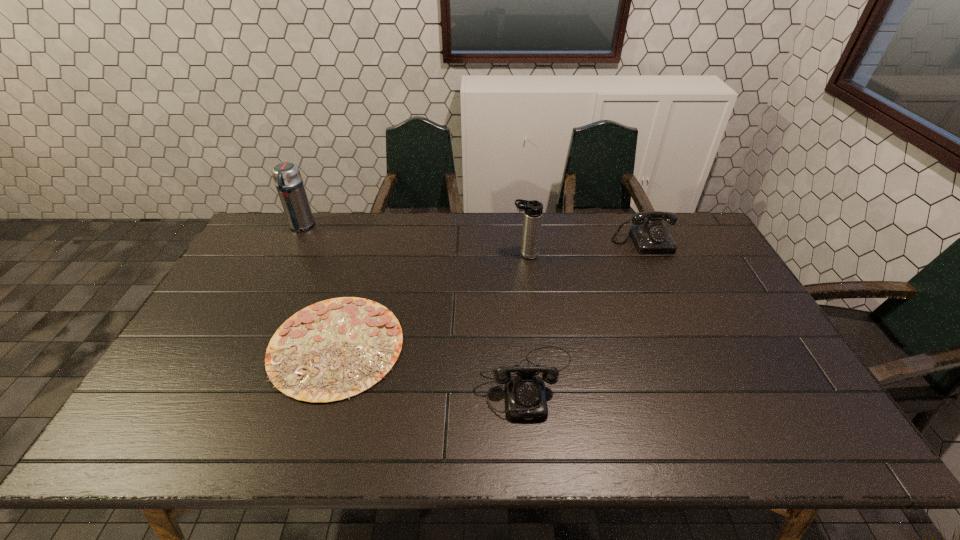
This screenshot has height=540, width=960. I want to click on vacant space at the far edge of the desktop, so click(338, 212).

Locate an element on the screen. free location at the near edge of the desktop is located at coordinates (672, 419).

In the image, there is a desktop. Find the location of `free space at the left edge`. free space at the left edge is located at coordinates (247, 275).

Locate an element on the screen. The image size is (960, 540). vacant space at the right edge is located at coordinates (783, 372).

You are a GUI agent. You are given a task and a screenshot of the screen. Output one action in this format:
    pyautogui.click(x=<x>, y=<y>)
    Task: Click on the vacant space in between the leftmost object and the rightmost object
    
    Given the screenshot: What is the action you would take?
    pyautogui.click(x=472, y=234)

The width and height of the screenshot is (960, 540). What are the coordinates of `unoccupied position between the left telephone and the fourth object from right to left` in the screenshot? It's located at (432, 363).

Find the location of a particular element. Image resolution: width=960 pixels, height=540 pixels. empty space that is in between the pizza and the leftmost object is located at coordinates (319, 286).

Where is `free space between the right thermos bottle and the rightmost object`? The height and width of the screenshot is (540, 960). free space between the right thermos bottle and the rightmost object is located at coordinates (584, 248).

Identify the location of unoccupied area between the right telephone and the pizza. The width and height of the screenshot is (960, 540). pyautogui.click(x=490, y=294).

You are a GUI agent. You are given a task and a screenshot of the screen. Output one action in this format:
    pyautogui.click(x=<x>, y=<y>)
    Task: Click on the empty location between the rightmost object and the left thermos bottle
    The image size is (960, 540).
    Given the screenshot: What is the action you would take?
    pyautogui.click(x=472, y=234)